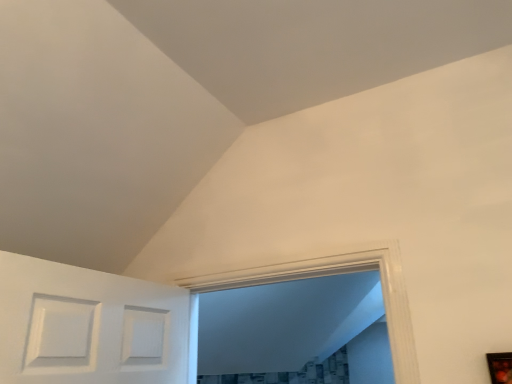
Measure the distance between point (x=501, y=365) and camera.

Point (x=501, y=365) is 1.20 meters away from camera.

What do you see at coordinates (499, 366) in the screenshot? I see `black matte picture frame at lower right` at bounding box center [499, 366].

Identify the location of black matte picture frame at lower right. The width and height of the screenshot is (512, 384). pyautogui.click(x=499, y=366).

You are a GUI agent. You are given a task and a screenshot of the screen. Output one action in this format:
    pyautogui.click(x=<x>, y=<y>)
    Task: Click on the black matte picture frame at lower right
    The height and width of the screenshot is (384, 512).
    Given the screenshot: What is the action you would take?
    pyautogui.click(x=499, y=366)